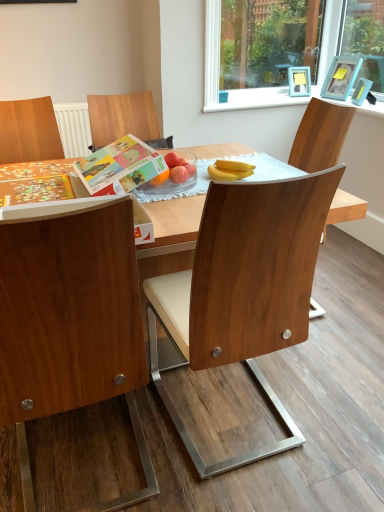
In order to click on vacant area located to the right-hand side of wooden chair at center, the 2th chair when ordered from left to right in this screenshot , I will do `click(328, 402)`.